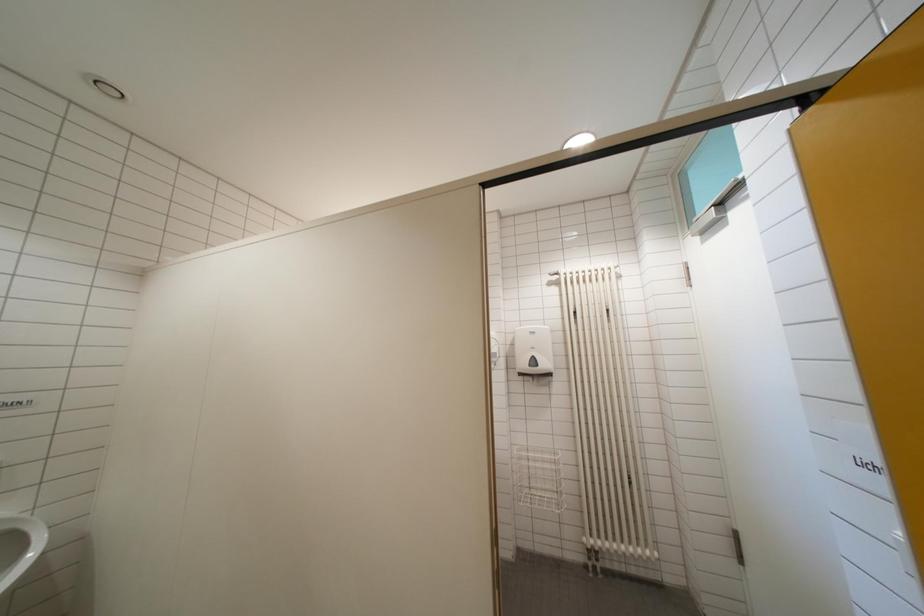
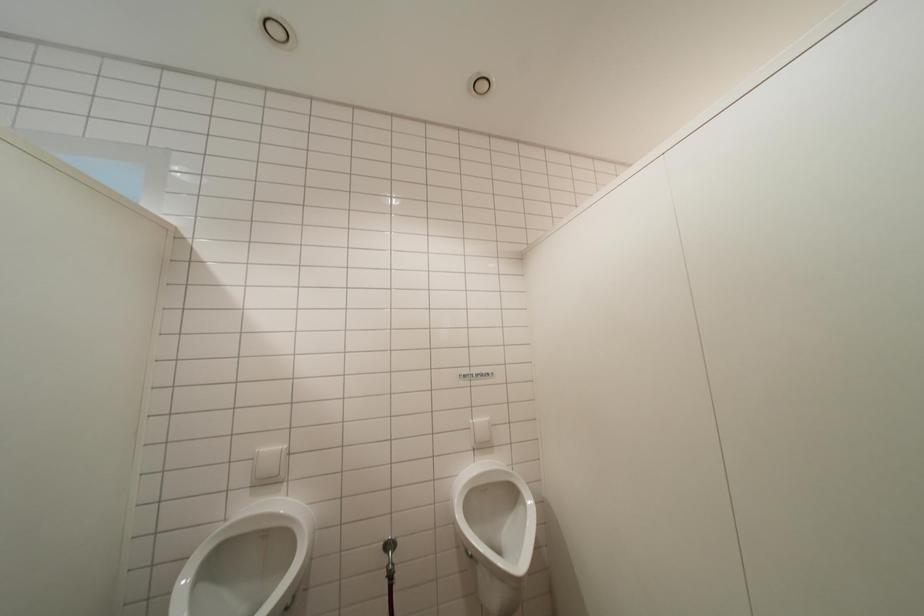
Question: The images are taken continuously from a first-person perspective. In which direction is your viewpoint rotating?

Choices:
 (A) Left
 (B) Right
 (C) Up
 (D) Down

Answer: (A)